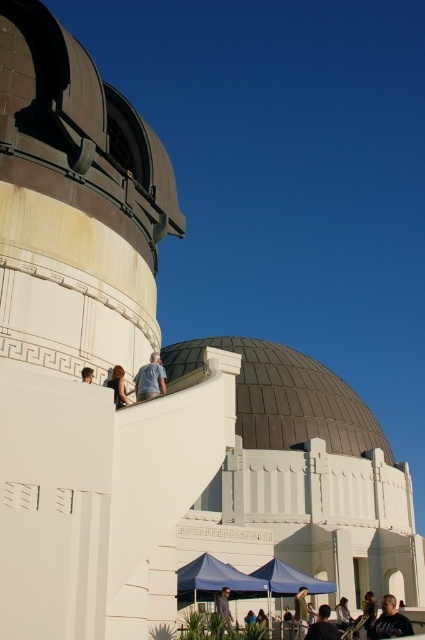
You are standing at the Griffith Observatory and want to take a photo of the two items mentioned. Which item should you focus on first if you want to capture both the light blue denim jeans at upper center and the dark brown leather jacket at lower center in the same frame?

You should focus on the light blue denim jeans at upper center first because it is positioned over the dark brown leather jacket at lower center, meaning it is closer to the camera. This will ensure both items are in focus when using a camera with a single focal point.

You are planning to take a photo of the Griffith Observatory with your camera, which has a focal length of 50mm. The two subjects in your frame are the light brown leather jacket at center and the light brown hair at upper center. To ensure both are in focus, what is the minimum distance you should set your hyperfocal distance? Assume the acceptable circle of confusion is 0.03 mm and the aperture is f8.

The hyperfocal distance calculation requires knowing the distance between the subjects and the camera. However, the provided information only states the distance between the two subjects is 81.44 feet. Without knowing their exact distances from the camera, it is impossible to determine the hyperfocal distance needed to keep both in focus.